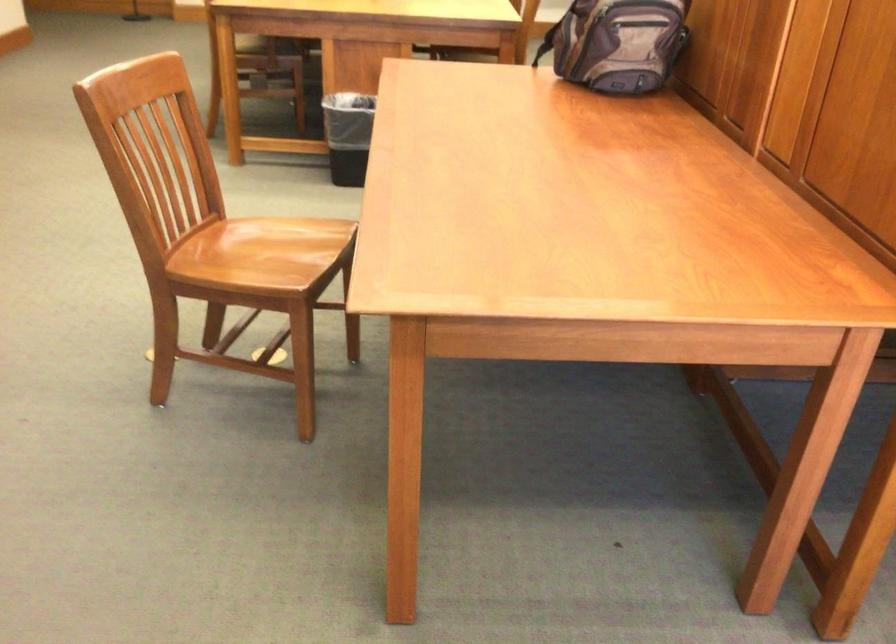
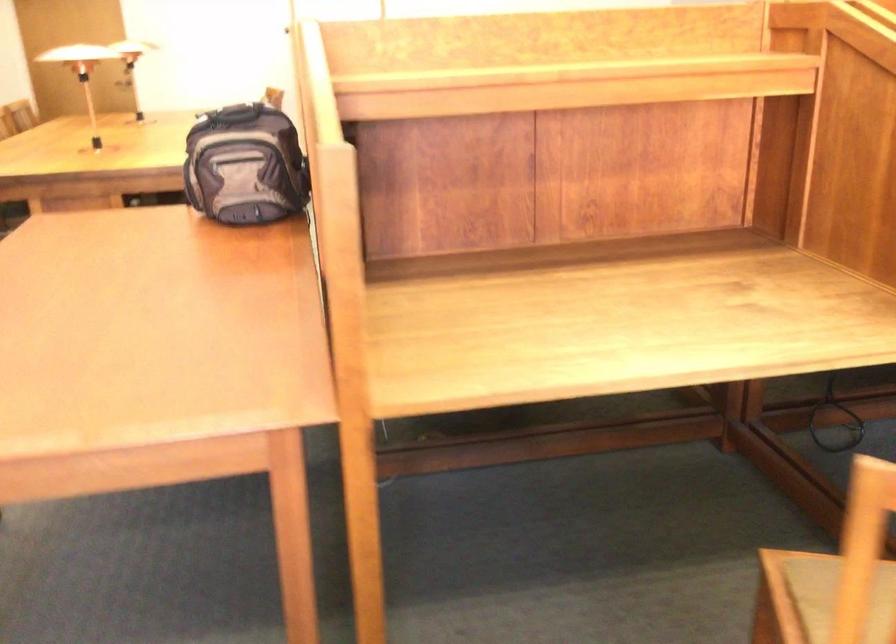
Question: In a continuous first-person perspective shot, in which direction is the camera moving?

Choices:
 (A) Left
 (B) Right
 (C) Forward
 (D) Backward

Answer: (B)